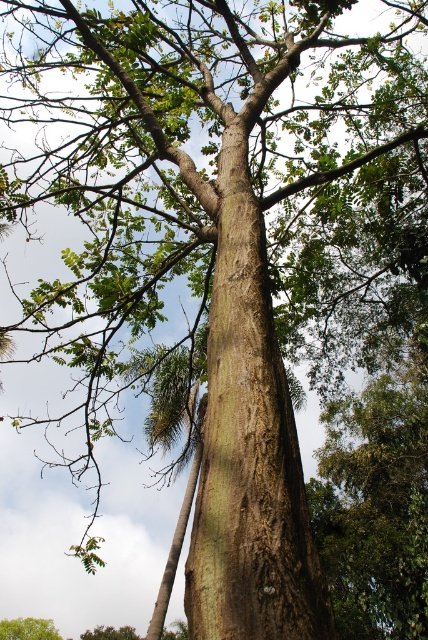
Does smooth brown bark at center have a lesser width compared to green rough bark tree at lower left?

Indeed, smooth brown bark at center has a lesser width compared to green rough bark tree at lower left.

Where is `smooth brown bark at center`? This screenshot has width=428, height=640. smooth brown bark at center is located at coordinates (249, 445).

Measure the distance between smooth brown bark at center and camera.

5.37 feet

The image size is (428, 640). In order to click on smooth brown bark at center in this screenshot , I will do `click(249, 445)`.